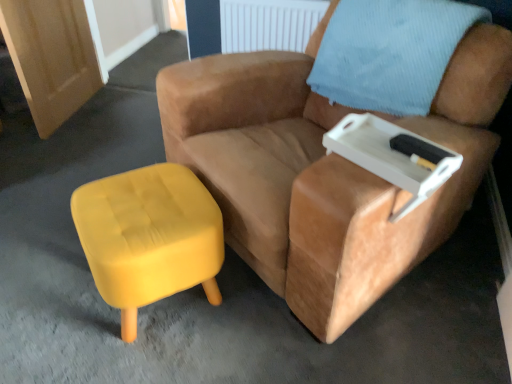
Question: Is white plastic tray at upper right oriented away from yellow fabric stool at lower left?

Choices:
 (A) no
 (B) yes

Answer: (A)

Question: Does white plastic tray at upper right touch yellow fabric stool at lower left?

Choices:
 (A) yes
 (B) no

Answer: (B)

Question: Considering the relative sizes of white plastic tray at upper right and yellow fabric stool at lower left in the image provided, is white plastic tray at upper right thinner than yellow fabric stool at lower left?

Choices:
 (A) no
 (B) yes

Answer: (B)

Question: Could you tell me if white plastic tray at upper right is turned towards yellow fabric stool at lower left?

Choices:
 (A) yes
 (B) no

Answer: (B)

Question: From the image's perspective, is white plastic tray at upper right beneath yellow fabric stool at lower left?

Choices:
 (A) yes
 (B) no

Answer: (B)

Question: From a real-world perspective, is light blue textured pillow at upper right positioned above or below yellow fabric stool at lower left?

Choices:
 (A) above
 (B) below

Answer: (A)

Question: Does point (309, 84) appear closer or farther from the camera than point (179, 273)?

Choices:
 (A) closer
 (B) farther

Answer: (B)

Question: In the image, is light blue textured pillow at upper right positioned in front of or behind yellow fabric stool at lower left?

Choices:
 (A) front
 (B) behind

Answer: (B)

Question: Is light blue textured pillow at upper right spatially inside yellow fabric stool at lower left, or outside of it?

Choices:
 (A) inside
 (B) outside

Answer: (B)

Question: Looking at the image, does yellow fabric stool at lower left seem bigger or smaller compared to suede tan armchair at center?

Choices:
 (A) small
 (B) big

Answer: (A)

Question: Relative to suede tan armchair at center, is yellow fabric stool at lower left in front or behind?

Choices:
 (A) front
 (B) behind

Answer: (B)

Question: Would you say yellow fabric stool at lower left is inside or outside suede tan armchair at center?

Choices:
 (A) inside
 (B) outside

Answer: (B)

Question: Is yellow fabric stool at lower left wider or thinner than suede tan armchair at center?

Choices:
 (A) thin
 (B) wide

Answer: (A)

Question: Considering the positions of point (425, 3) and point (445, 167), is point (425, 3) closer or farther from the camera than point (445, 167)?

Choices:
 (A) farther
 (B) closer

Answer: (A)

Question: Is light blue textured pillow at upper right in front of or behind white plastic tray at upper right in the image?

Choices:
 (A) behind
 (B) front

Answer: (A)